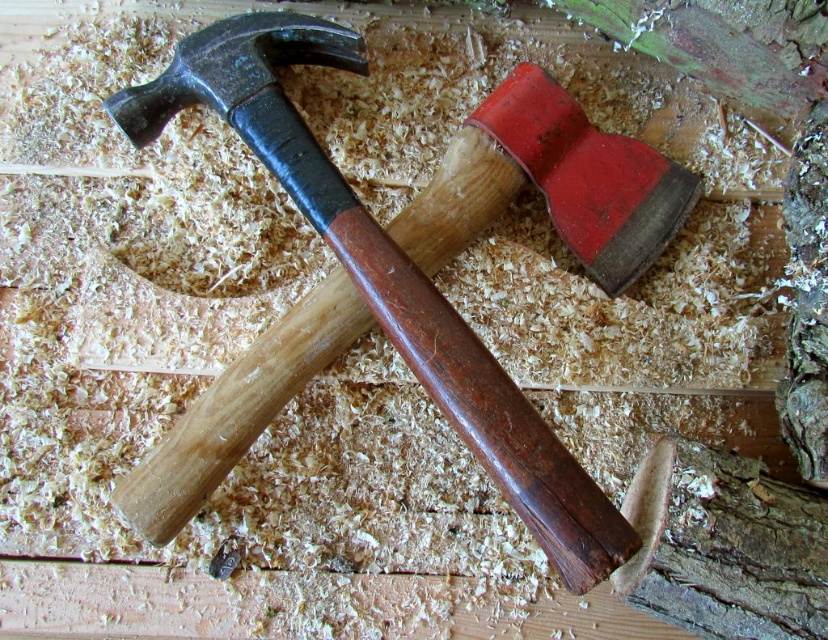
You are a carpenter who needs to move a tool from the matte black hammer at upper left to the smooth bark tree trunk at lower right. What is the minimum distance you need to move the hammer to reach the tree trunk?

The minimum distance you need to move the matte black hammer at upper left to reach the smooth bark tree trunk at lower right is 27.42 centimeters.

You are a carpenter trying to organize your tools. You need to place the matte black hammer at upper left and the smooth bark tree trunk at lower right on a shelf. Which tool should you place first if you want to arrange them from left to right as they appear in the image?

The matte black hammer at upper left should be placed first on the left side of the shelf since it is positioned on the left side of the smooth bark tree trunk at lower right in the image.

You are standing at the origin point of the image and want to reach the point labeled as point (781,625). Which direction should you move relative to point (290,348)?

Answer: To reach point (781,625) from the origin, you should move in the direction away from point (290,348) since point (290,348) is behind point (781,625).